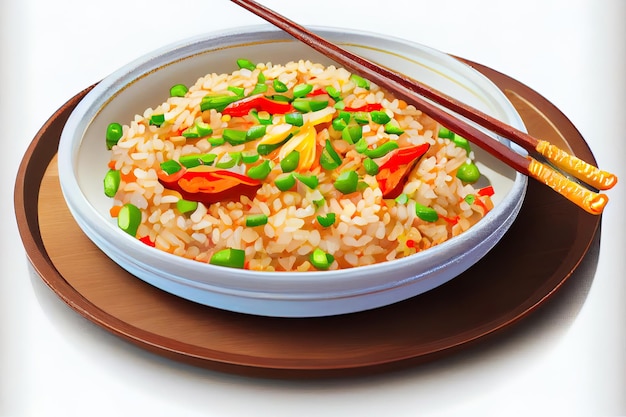
Image resolution: width=626 pixels, height=417 pixels. In order to click on white dish shadow in this screenshot , I will do `click(516, 277)`.